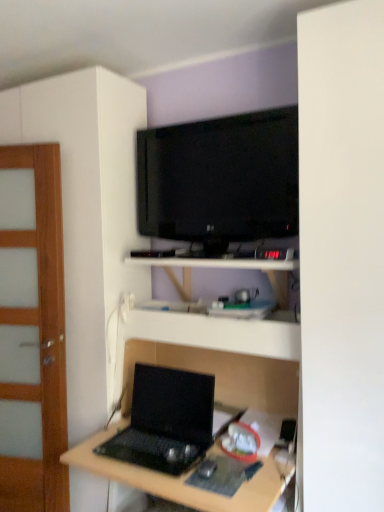
Identify the location of free space in front of black plastic mouse at lower center. The height and width of the screenshot is (512, 384). (210, 484).